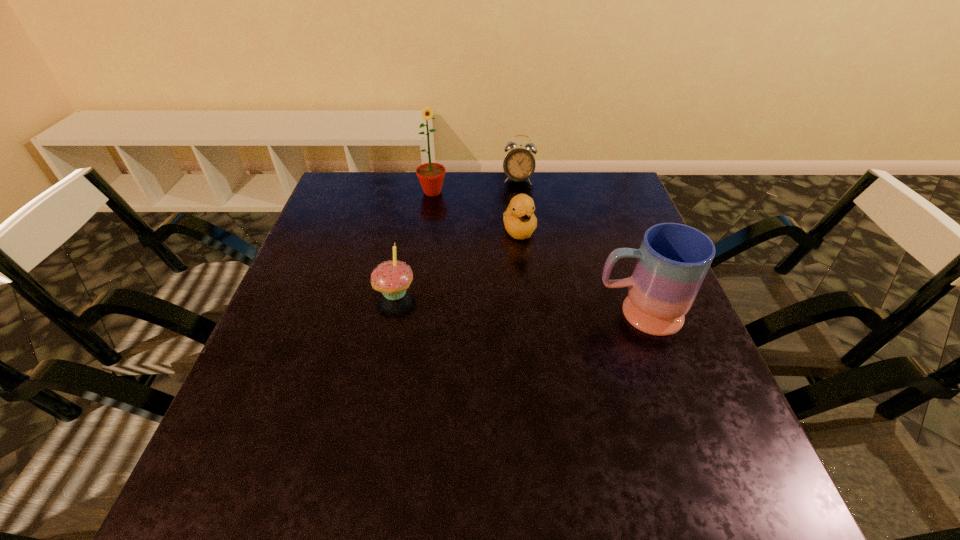
Image resolution: width=960 pixels, height=540 pixels. What are the coordinates of `vacant space on the desktop that is between the cupcake and the second tallest object and is positioned on the face of the tallest object` in the screenshot? It's located at (500, 302).

Locate an element on the screen. free space on the desktop that is between the cupcake and the fourth shortest object and is positioned facing forward on the third nearest object is located at coordinates (540, 305).

Find the location of a particular element. free space on the desktop that is between the cupcake and the rightmost object and is positioned on the face of the alarm clock is located at coordinates (501, 302).